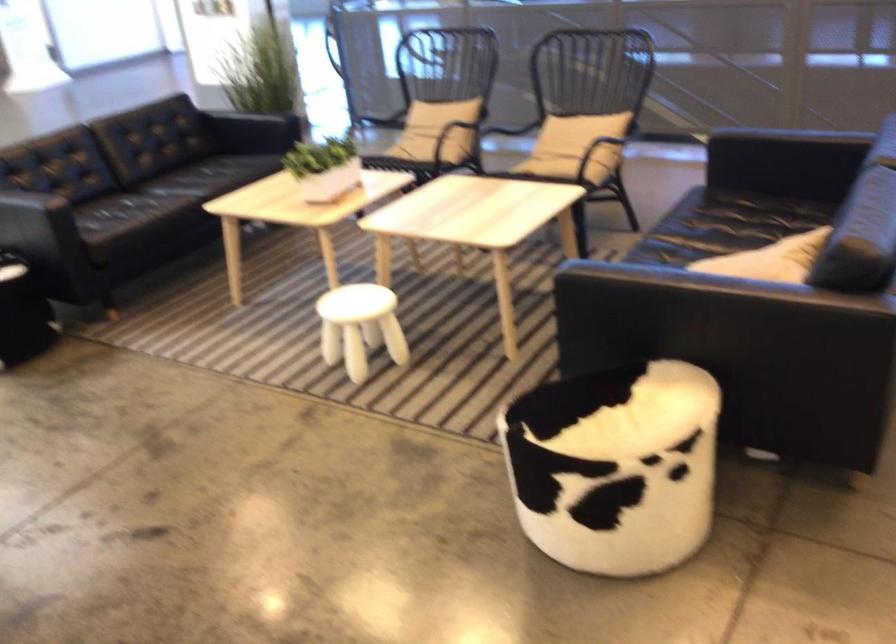
The image size is (896, 644). Describe the element at coordinates (323, 167) in the screenshot. I see `the white potted plant` at that location.